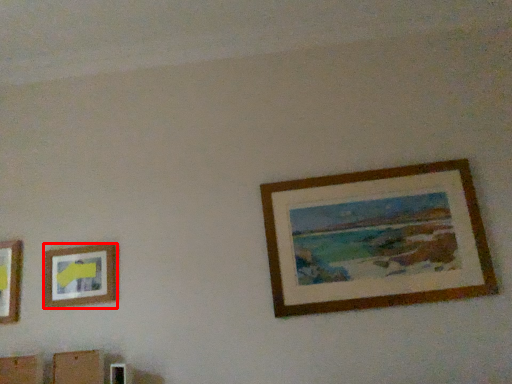
Question: In this image, where is picture frame (annotated by the red box) located relative to picture frame?

Choices:
 (A) right
 (B) left

Answer: (B)